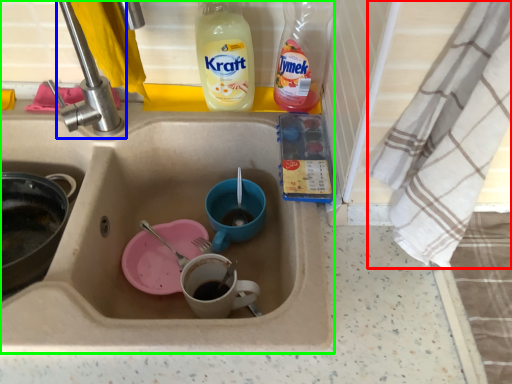
Question: Based on their relative distances, which object is farther from cloth (highlighted by a red box)? Choose from tap (highlighted by a blue box) and sink (highlighted by a green box).

Choices:
 (A) tap
 (B) sink

Answer: (A)